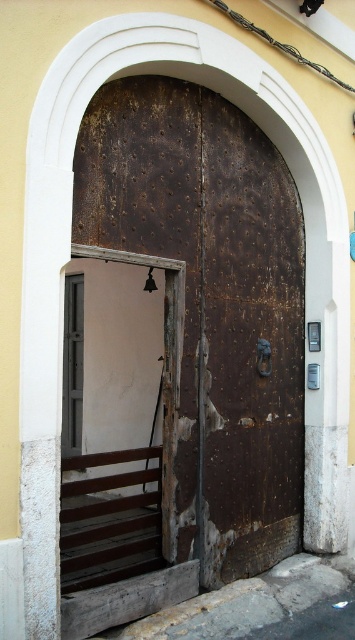
Does rusty metal door at center have a lesser width compared to metallic gray door at left?

Incorrect, rusty metal door at center's width is not less than metallic gray door at left's.

Can you confirm if rusty metal door at center is smaller than metallic gray door at left?

No, rusty metal door at center is not smaller than metallic gray door at left.

Is point (299, 298) behind point (62, 369)?

Yes, it is behind point (62, 369).

Image resolution: width=355 pixels, height=640 pixels. Find the location of `rusty metal door at center`. rusty metal door at center is located at coordinates (211, 301).

The image size is (355, 640). I want to click on brown wooden slats at lower left, so click(x=110, y=522).

Which is below, brown wooden slats at lower left or metallic gray door at left?

brown wooden slats at lower left

Measure the distance between point (144, 522) and camera.

Point (144, 522) and camera are 14.01 feet apart.

This screenshot has width=355, height=640. What are the coordinates of `brown wooden slats at lower left` in the screenshot? It's located at (110, 522).

Which is more to the left, rusty metal door at center or brown wooden slats at lower left?

brown wooden slats at lower left

In the scene shown: Who is shorter, rusty metal door at center or brown wooden slats at lower left?

brown wooden slats at lower left

Does point (146, 198) come farther from viewer compared to point (146, 467)?

No.

At what (x,y) coordinates should I click in order to perform the action: click on rusty metal door at center. Please return your answer as a coordinate pair (x, y). The height and width of the screenshot is (640, 355). Looking at the image, I should click on (211, 301).